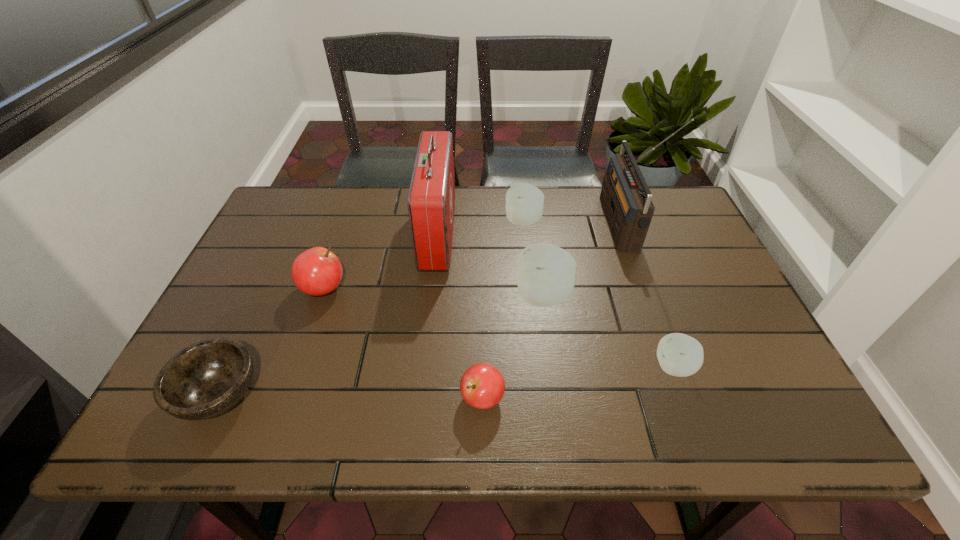
You are a GUI agent. You are given a task and a screenshot of the screen. Output one action in this format:
    pyautogui.click(x=<x>, y=<y>)
    Task: Click on the free spot located 0.200m on the front of the bigger red apple
    This screenshot has height=540, width=960.
    Given the screenshot: What is the action you would take?
    pyautogui.click(x=294, y=375)

This screenshot has height=540, width=960. Find the location of `vacant area situated on the back of the rightmost white apple`. vacant area situated on the back of the rightmost white apple is located at coordinates (661, 333).

Identify the location of vacant region located 0.140m on the left of the right red apple. The image size is (960, 540). [394, 398].

At what (x,y) coordinates should I click in order to perform the action: click on free spot located 0.390m on the back of the bowl. Please return your answer as a coordinate pair (x, y). Looking at the image, I should click on (289, 245).

You are a GUI agent. You are given a task and a screenshot of the screen. Output one action in this format:
    pyautogui.click(x=<x>, y=<y>)
    Task: Click on the radio receiver that is positioned at the far edge
    This screenshot has height=540, width=960.
    Given the screenshot: What is the action you would take?
    pyautogui.click(x=625, y=196)

Find the location of `the first-aid kit that is at the far edge`. the first-aid kit that is at the far edge is located at coordinates (431, 199).

Identify the location of apple situated at the far edge. (524, 206).

Identify the location of apple that is at the near edge. point(482,386).

I want to click on bowl at the near edge, so click(x=206, y=379).

The height and width of the screenshot is (540, 960). In order to click on object situated at the left edge in this screenshot , I will do `click(206, 379)`.